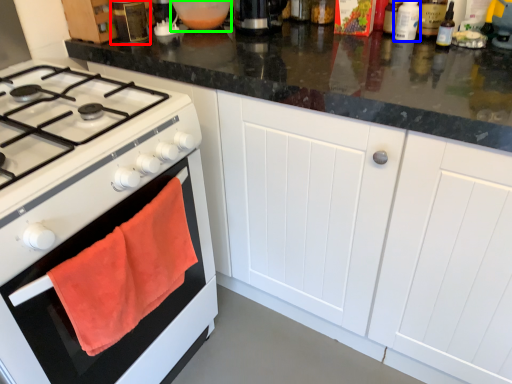
Question: Based on their relative distances, which object is farther from kitchen appliance (highlighted by a red box)? Choose from bottle (highlighted by a blue box) and appliance (highlighted by a green box).

Choices:
 (A) bottle
 (B) appliance

Answer: (A)